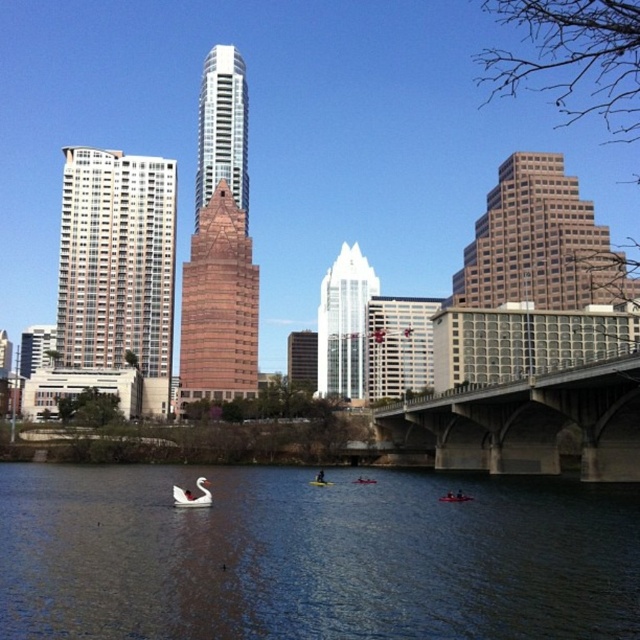
Who is higher up, concrete bridge at center or white matte swan at lower center?

concrete bridge at center is above.

Who is positioned more to the right, concrete bridge at center or white matte swan at lower center?

A: Positioned to the right is concrete bridge at center.

Is point (625, 376) less distant than point (196, 497)?

No, it is behind (196, 497).

Locate an element on the screen. This screenshot has width=640, height=640. concrete bridge at center is located at coordinates (529, 422).

Is concrete bridge at center smaller than orange plastic kayak at lower center?

No.

This screenshot has height=640, width=640. Describe the element at coordinates (529, 422) in the screenshot. I see `concrete bridge at center` at that location.

Where is `concrete bridge at center`? Image resolution: width=640 pixels, height=640 pixels. concrete bridge at center is located at coordinates (529, 422).

Which is above, orange plastic kayak at lower center or red plastic kayak at center?

Positioned higher is orange plastic kayak at lower center.

Locate an element on the screen. The height and width of the screenshot is (640, 640). orange plastic kayak at lower center is located at coordinates (454, 497).

Which is behind, point (461, 493) or point (364, 477)?

The point (364, 477) is behind.

Identify the location of orange plastic kayak at lower center. (454, 497).